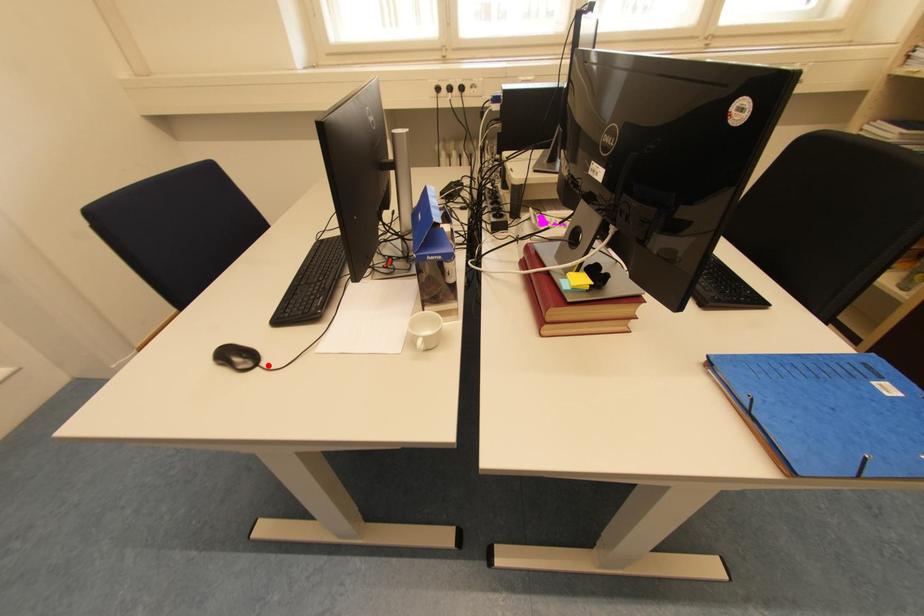
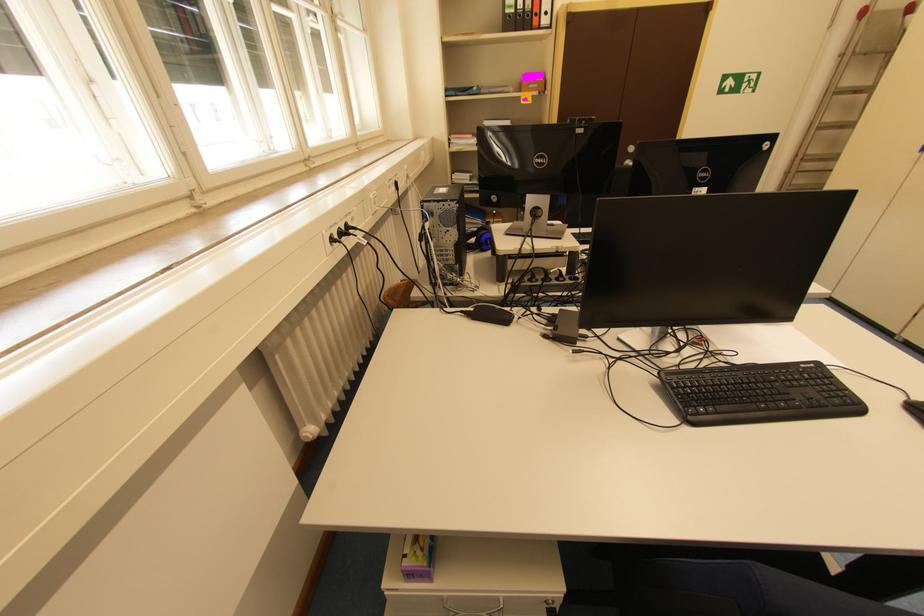
In the second image, find the point that corresponds to the highlighted location in the first image.

(915, 400)